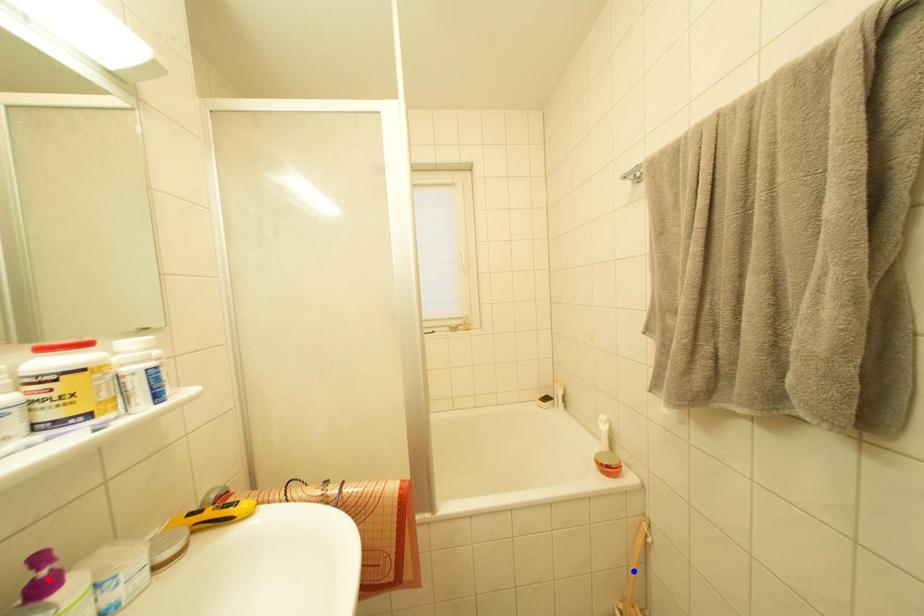
Question: In the image, two points are highlighted. Which point is nearer to the camera? Reply with the corresponding letter.

Choices:
 (A) blue point
 (B) red point

Answer: (B)